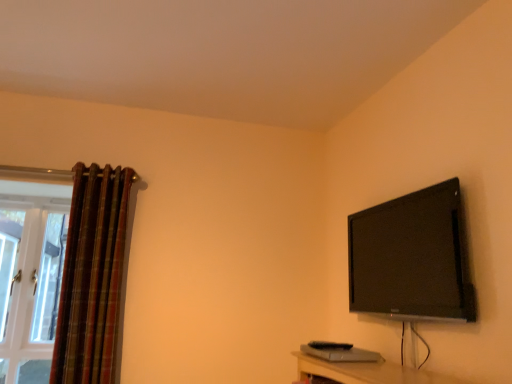
The width and height of the screenshot is (512, 384). Find the location of `black glossy tv at upper right`. black glossy tv at upper right is located at coordinates (412, 257).

What do you see at coordinates (92, 276) in the screenshot? I see `plaid fabric curtain at left` at bounding box center [92, 276].

The height and width of the screenshot is (384, 512). What are the coordinates of `black glossy tv at upper right` in the screenshot? It's located at (412, 257).

Would you say black glossy tv at upper right is outside plaid fabric curtain at left?

That's correct, black glossy tv at upper right is outside of plaid fabric curtain at left.

Which of these two, black glossy tv at upper right or plaid fabric curtain at left, is thinner?

Thinner between the two is black glossy tv at upper right.

Can you see black glossy tv at upper right touching plaid fabric curtain at left?

No, black glossy tv at upper right is not making contact with plaid fabric curtain at left.

The width and height of the screenshot is (512, 384). In the image, there is a plaid fabric curtain at left. In order to click on window below it (from the image's perspective) in this screenshot , I will do `click(31, 268)`.

How different are the orientations of plaid fabric curtain at left and white glass door at left in degrees?

They differ by 1.79 degrees in their facing directions.

In the scene shown: Is plaid fabric curtain at left not within white glass door at left?

Yes, plaid fabric curtain at left is not within white glass door at left.

Which object is thinner, plaid fabric curtain at left or white glass door at left?

Thinner between the two is white glass door at left.

From the image's perspective, is white glass door at left above or below plaid fabric curtain at left?

From the image's perspective, white glass door at left appears below plaid fabric curtain at left.

Between white glass door at left and plaid fabric curtain at left, which one has larger width?

With larger width is plaid fabric curtain at left.

Does white glass door at left have a larger size compared to plaid fabric curtain at left?

No.

Which is more to the left, black glossy tv at upper right or white glass door at left?

white glass door at left is more to the left.

From the image's perspective, is black glossy tv at upper right above or below white glass door at left?

From the image's perspective, black glossy tv at upper right appears above white glass door at left.

Is black glossy tv at upper right inside or outside of white glass door at left?

black glossy tv at upper right is outside white glass door at left.

How distant is black glossy tv at upper right from white glass door at left?

A distance of 6.75 feet exists between black glossy tv at upper right and white glass door at left.

Is black glossy tv at upper right located within plaid fabric curtain at left?

That's incorrect, black glossy tv at upper right is not inside plaid fabric curtain at left.

Does plaid fabric curtain at left appear on the left side of black glossy tv at upper right?

Correct, you'll find plaid fabric curtain at left to the left of black glossy tv at upper right.

From the image's perspective, is plaid fabric curtain at left on black glossy tv at upper right?

Actually, plaid fabric curtain at left appears below black glossy tv at upper right in the image.

Looking at their sizes, would you say plaid fabric curtain at left is wider or thinner than black glossy tv at upper right?

plaid fabric curtain at left is wider than black glossy tv at upper right.

Is white glass door at left located outside black glossy tv at upper right?

Absolutely, white glass door at left is external to black glossy tv at upper right.

Is white glass door at left positioned with its back to black glossy tv at upper right?

white glass door at left does not have its back to black glossy tv at upper right.

Considering their positions, is white glass door at left located in front of or behind black glossy tv at upper right?

white glass door at left is behind black glossy tv at upper right.

Find the location of a particular element. curtain located underneath the black glossy tv at upper right (from a real-world perspective) is located at coordinates (92, 276).

Find the location of a particular element. The image size is (512, 384). window behind the plaid fabric curtain at left is located at coordinates (x=31, y=268).

From the image, which object appears to be farther from plaid fabric curtain at left, black glossy tv at upper right or white glass door at left?

black glossy tv at upper right.

When comparing their distances from black glossy tv at upper right, does white glass door at left or plaid fabric curtain at left seem further?

white glass door at left is further to black glossy tv at upper right.

Looking at this image, considering their positions, is white glass door at left positioned further to plaid fabric curtain at left than black glossy tv at upper right?

black glossy tv at upper right is positioned further to the anchor plaid fabric curtain at left.

From the image, which object appears to be farther from white glass door at left, plaid fabric curtain at left or black glossy tv at upper right?

black glossy tv at upper right is positioned further to the anchor white glass door at left.

Which object lies nearer to the anchor point white glass door at left, black glossy tv at upper right or plaid fabric curtain at left?

plaid fabric curtain at left is positioned closer to the anchor white glass door at left.

Looking at the image, which one is located further to black glossy tv at upper right, plaid fabric curtain at left or white glass door at left?

white glass door at left is further to black glossy tv at upper right.

Where is `curtain between white glass door at left and black glossy tv at upper right in the horizontal direction`? The image size is (512, 384). curtain between white glass door at left and black glossy tv at upper right in the horizontal direction is located at coordinates (92, 276).